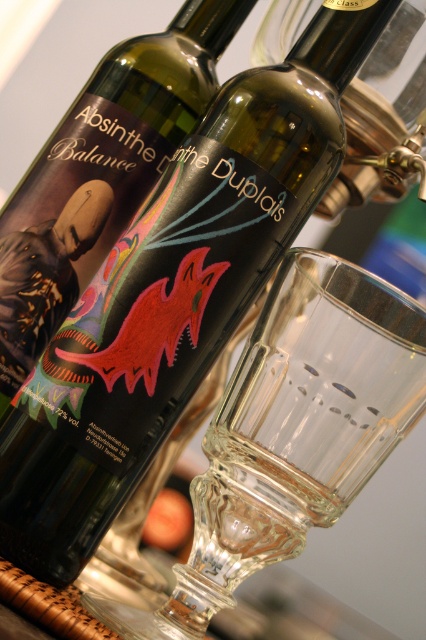
Does point (207, 451) come behind point (175, 44)?

No, it is in front of (175, 44).

This screenshot has width=426, height=640. Find the location of `transparent glass at center`. transparent glass at center is located at coordinates (291, 433).